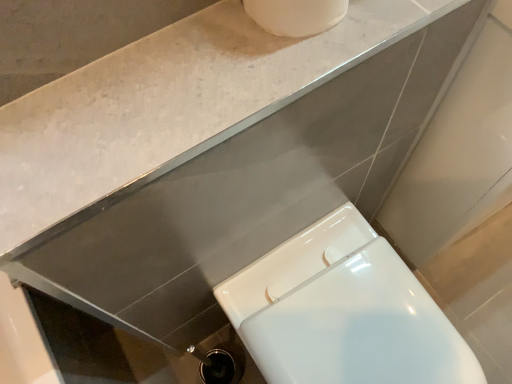
Question: From a real-world perspective, is white glossy toilet at lower right physically located above or below white glossy countertop at upper center?

Choices:
 (A) below
 (B) above

Answer: (A)

Question: Is point (287, 369) positioned closer to the camera than point (167, 109)?

Choices:
 (A) closer
 (B) farther

Answer: (B)

Question: Considering the relative positions of white glossy toilet at lower right and white glossy countertop at upper center in the image provided, is white glossy toilet at lower right to the left or to the right of white glossy countertop at upper center?

Choices:
 (A) left
 (B) right

Answer: (B)

Question: Is white glossy countertop at upper center taller or shorter than white glossy toilet at lower right?

Choices:
 (A) tall
 (B) short

Answer: (B)

Question: Considering the positions of white glossy countertop at upper center and white glossy toilet at lower right in the image, is white glossy countertop at upper center bigger or smaller than white glossy toilet at lower right?

Choices:
 (A) small
 (B) big

Answer: (A)

Question: Is white glossy countertop at upper center inside or outside of white glossy toilet at lower right?

Choices:
 (A) outside
 (B) inside

Answer: (A)

Question: Is point (131, 77) closer or farther from the camera than point (376, 345)?

Choices:
 (A) farther
 (B) closer

Answer: (B)